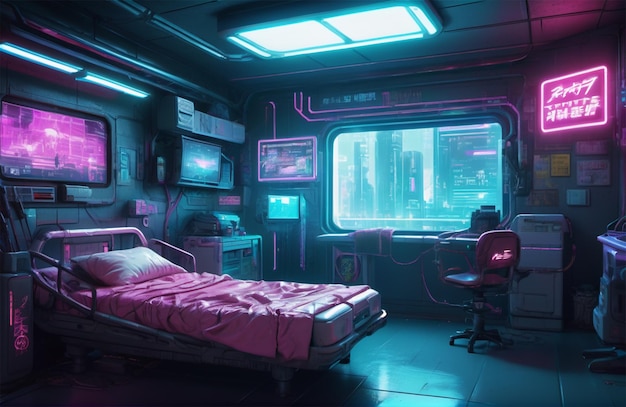
This screenshot has height=407, width=626. I want to click on adjustable bed, so click(x=242, y=300).